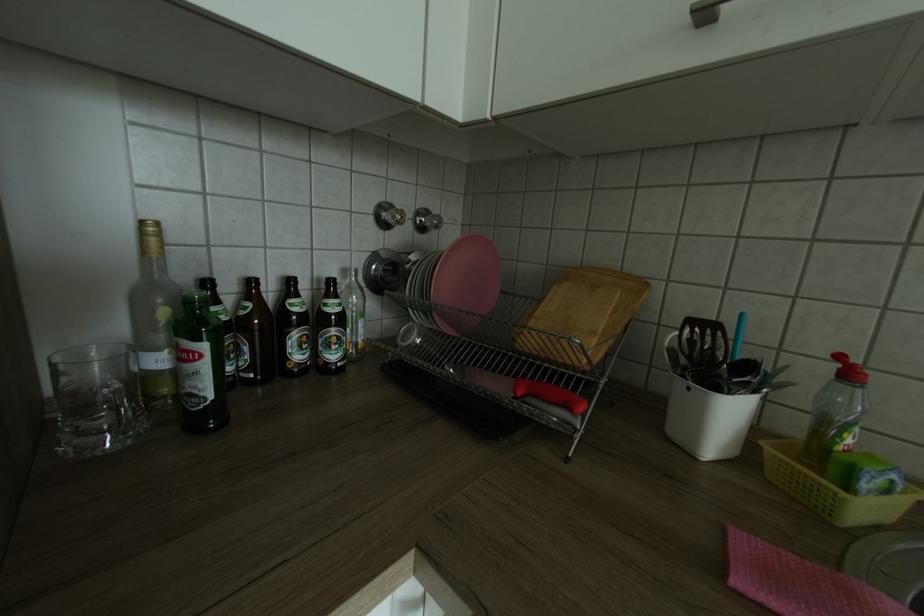
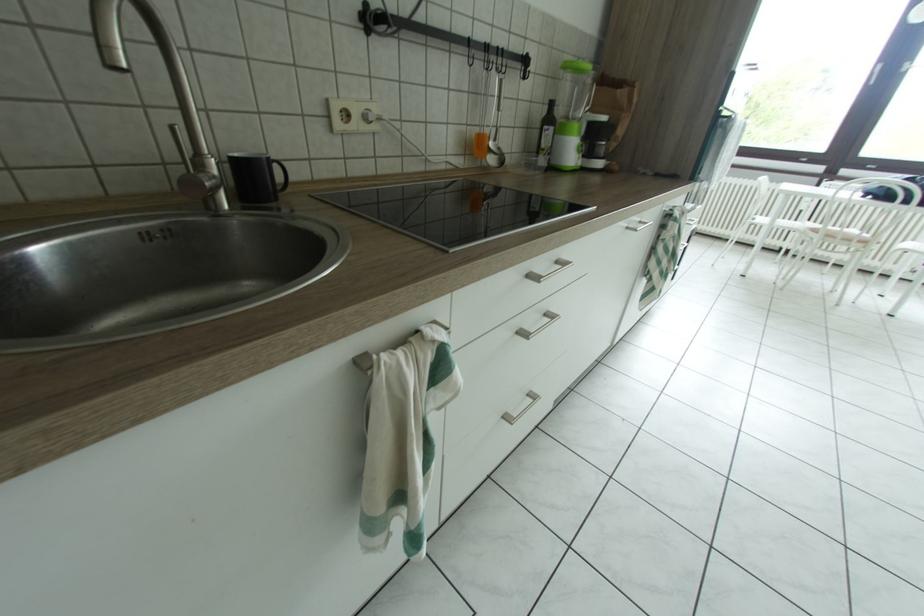
Based on the continuous images, in which direction is the camera rotating?

The rotation direction of the camera is right-down.